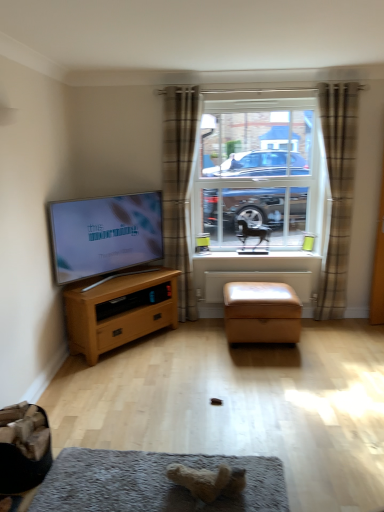
This screenshot has width=384, height=512. Identify the location of free space underneath wooden chest of drawers at left (from a real-world perspective). (145, 340).